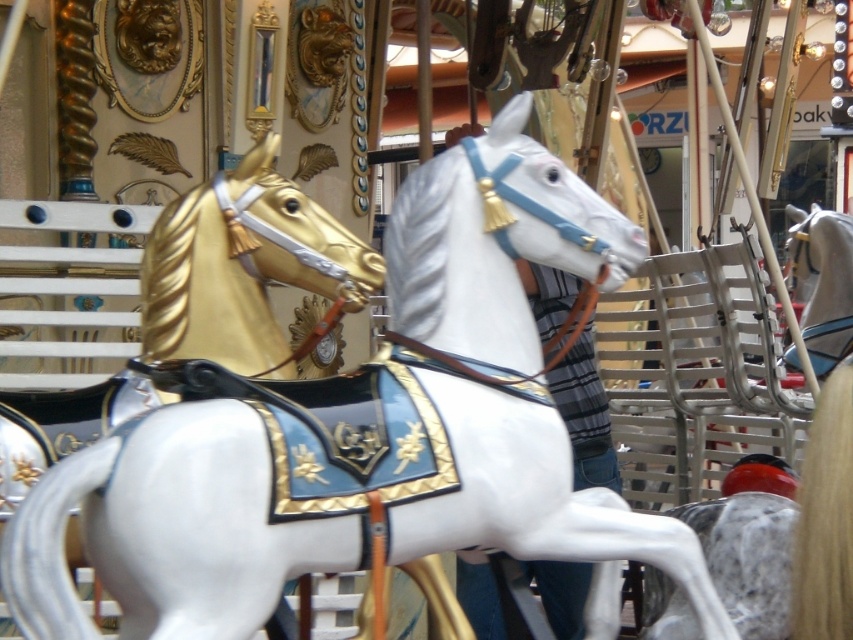
Question: Does gold polished wood horse at upper left have a smaller size compared to shiny silver horse at center?

Choices:
 (A) yes
 (B) no

Answer: (A)

Question: Does gold polished wood horse at upper left appear on the left side of shiny silver horse at center?

Choices:
 (A) yes
 (B) no

Answer: (A)

Question: Is gold polished wood horse at upper left thinner than shiny silver horse at center?

Choices:
 (A) no
 (B) yes

Answer: (B)

Question: Based on their relative distances, which object is farther from the white glossy horse at center?

Choices:
 (A) shiny silver horse at center
 (B) gold polished wood horse at upper left

Answer: (A)

Question: Which point is farther to the camera?

Choices:
 (A) pyautogui.click(x=457, y=372)
 (B) pyautogui.click(x=836, y=330)
 (C) pyautogui.click(x=94, y=396)

Answer: (B)

Question: Which of the following is the closest to the observer?

Choices:
 (A) gold polished wood horse at upper left
 (B) white glossy horse at center

Answer: (B)